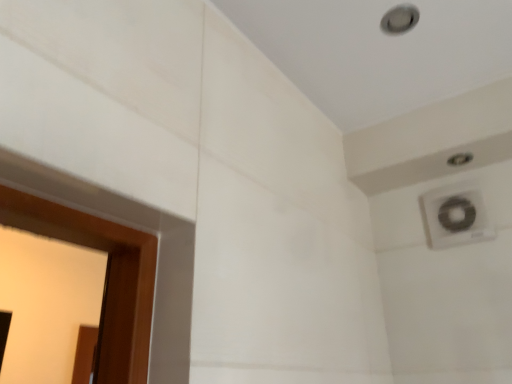
Question: From the image's perspective, is matte silver hole at upper right on white plastic air conditioning at upper right?

Choices:
 (A) no
 (B) yes

Answer: (B)

Question: Is matte silver hole at upper right smaller than white plastic air conditioning at upper right?

Choices:
 (A) yes
 (B) no

Answer: (A)

Question: Is matte silver hole at upper right in front of white plastic air conditioning at upper right?

Choices:
 (A) no
 (B) yes

Answer: (B)

Question: Is matte silver hole at upper right oriented away from white plastic air conditioning at upper right?

Choices:
 (A) no
 (B) yes

Answer: (A)

Question: Does matte silver hole at upper right appear on the left side of white plastic air conditioning at upper right?

Choices:
 (A) no
 (B) yes

Answer: (B)

Question: Is matte silver hole at upper right directly adjacent to white plastic air conditioning at upper right?

Choices:
 (A) yes
 (B) no

Answer: (B)

Question: Does white plastic air conditioning at upper right contain matte silver hole at upper right?

Choices:
 (A) yes
 (B) no

Answer: (B)

Question: Considering the relative sizes of white plastic air conditioning at upper right and matte silver hole at upper right in the image provided, is white plastic air conditioning at upper right smaller than matte silver hole at upper right?

Choices:
 (A) no
 (B) yes

Answer: (A)

Question: Can you confirm if white plastic air conditioning at upper right is positioned to the left of matte silver hole at upper right?

Choices:
 (A) no
 (B) yes

Answer: (A)

Question: Is white plastic air conditioning at upper right turned away from matte silver hole at upper right?

Choices:
 (A) no
 (B) yes

Answer: (A)

Question: From the image's perspective, is white plastic air conditioning at upper right below matte silver hole at upper right?

Choices:
 (A) no
 (B) yes

Answer: (B)

Question: From a real-world perspective, is white plastic air conditioning at upper right positioned under matte silver hole at upper right based on gravity?

Choices:
 (A) yes
 (B) no

Answer: (A)

Question: In the image, is white plastic air conditioning at upper right on the left side or the right side of matte silver hole at upper right?

Choices:
 (A) left
 (B) right

Answer: (B)